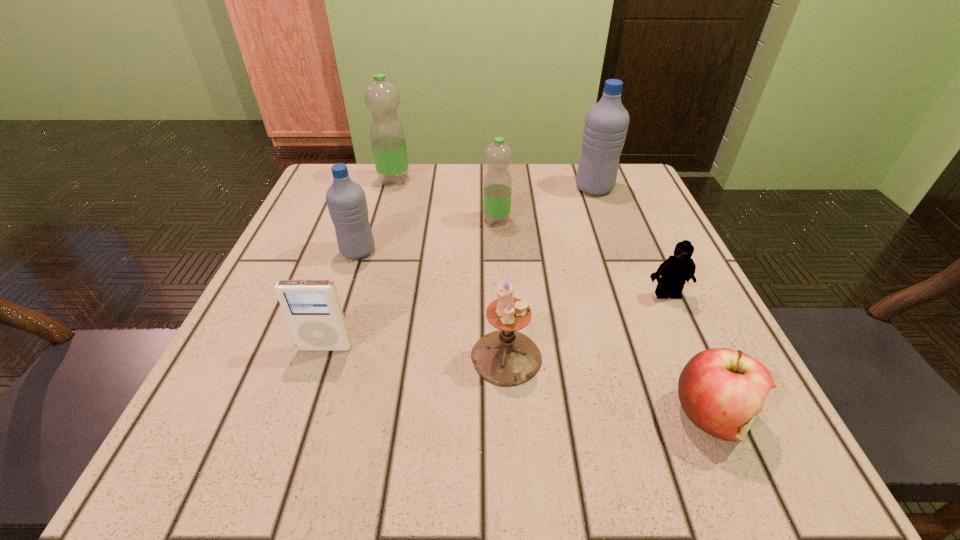
Identify the location of the right blue water bottle. (606, 123).

Locate an element on the screen. The height and width of the screenshot is (540, 960). the bigger blue water bottle is located at coordinates (606, 123).

Where is `the left green water bottle`? Image resolution: width=960 pixels, height=540 pixels. the left green water bottle is located at coordinates (387, 134).

Identify the location of the farther green water bottle. (387, 134).

Locate an element on the screen. the right green water bottle is located at coordinates (497, 189).

At what (x,y) coordinates should I click in order to perform the action: click on the third water bottle from left to right. Please return your answer as a coordinate pair (x, y). Looking at the image, I should click on (497, 189).

This screenshot has width=960, height=540. Identify the location of the nearer blue water bottle. (346, 200).

At what (x,y) coordinates should I click in order to perform the action: click on the fourth farthest object. Please return your answer as a coordinate pair (x, y). The height and width of the screenshot is (540, 960). Looking at the image, I should click on (346, 200).

The width and height of the screenshot is (960, 540). Identify the location of candle holder. (506, 357).

You are a GUI agent. You are given a task and a screenshot of the screen. Output one action in this format:
    pyautogui.click(x=<x>, y=<y>)
    Task: Click on the third shortest object
    The height and width of the screenshot is (540, 960).
    Given the screenshot: What is the action you would take?
    pyautogui.click(x=312, y=308)